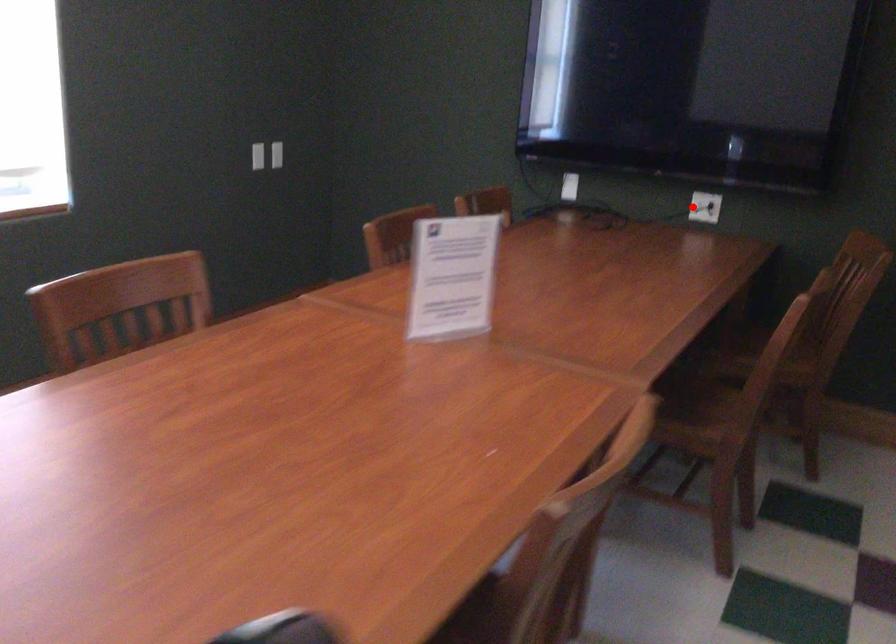
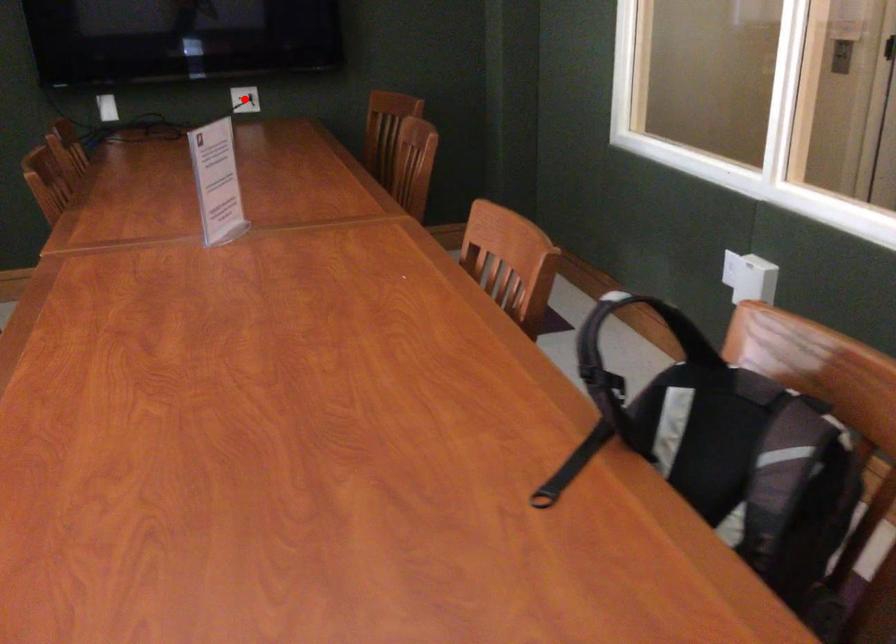
I am providing you with two images of the same scene from different viewpoints. A red point is marked on the first image and another point is marked on the second image. Is the marked point in image1 the same physical position as the marked point in image2?

Yes